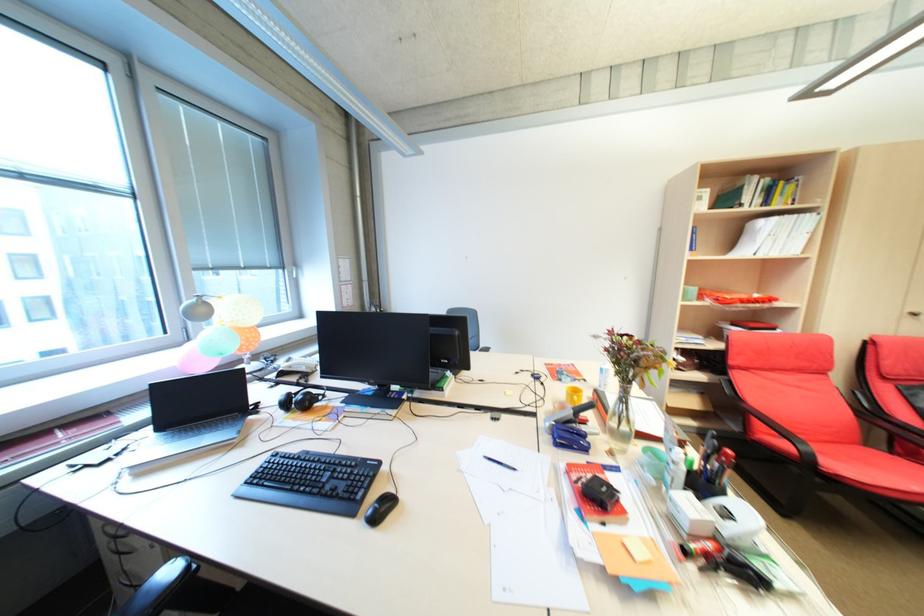
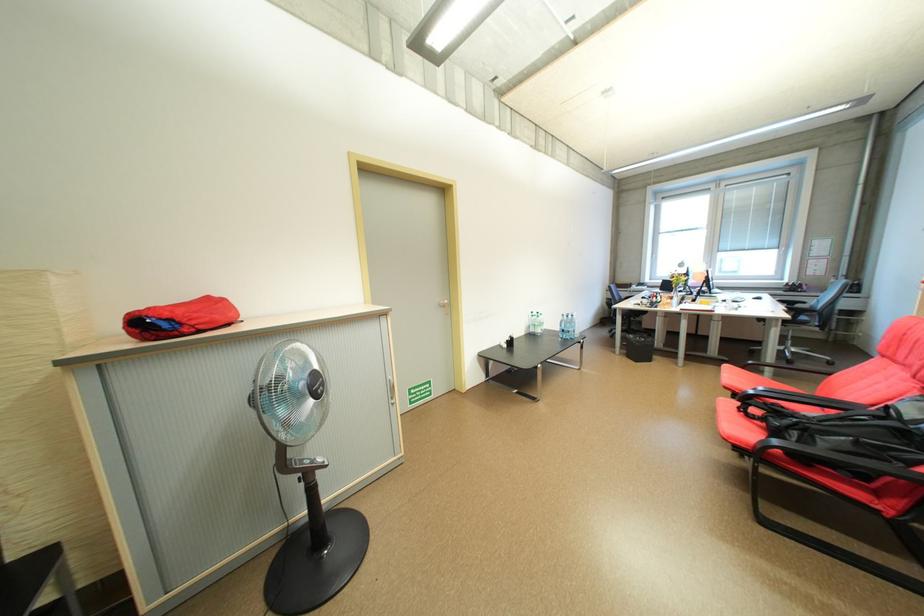
Question: I am providing you with two images of the same scene from different viewpoints. Please identify which objects are invisible in image2.

Choices:
 (A) blue coffee press
 (B) computer keyboard
 (C) black chair armrest
 (D) door handle

Answer: (C)